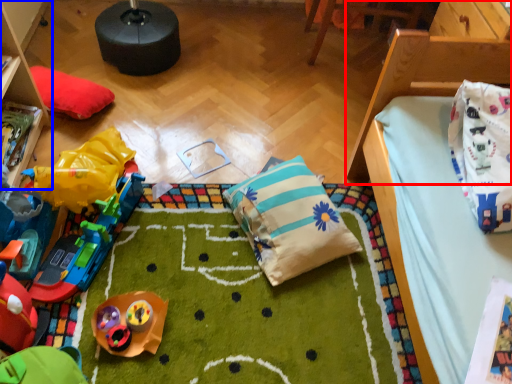
Question: Which point is closer to the camera, furniture (highlighted by a red box) or furniture (highlighted by a blue box)?

Choices:
 (A) furniture
 (B) furniture

Answer: (A)